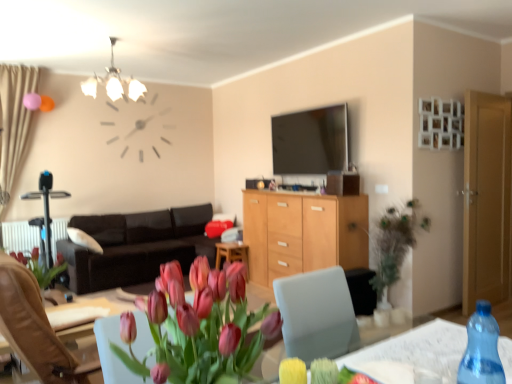
Identify the location of vacant space situated above matte glass chandelier at upper center (from a real-world perspective). click(120, 34).